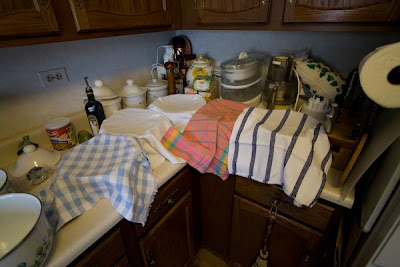
Identify the location of cannister lids. (106, 93), (135, 89), (157, 84), (38, 150), (200, 61).